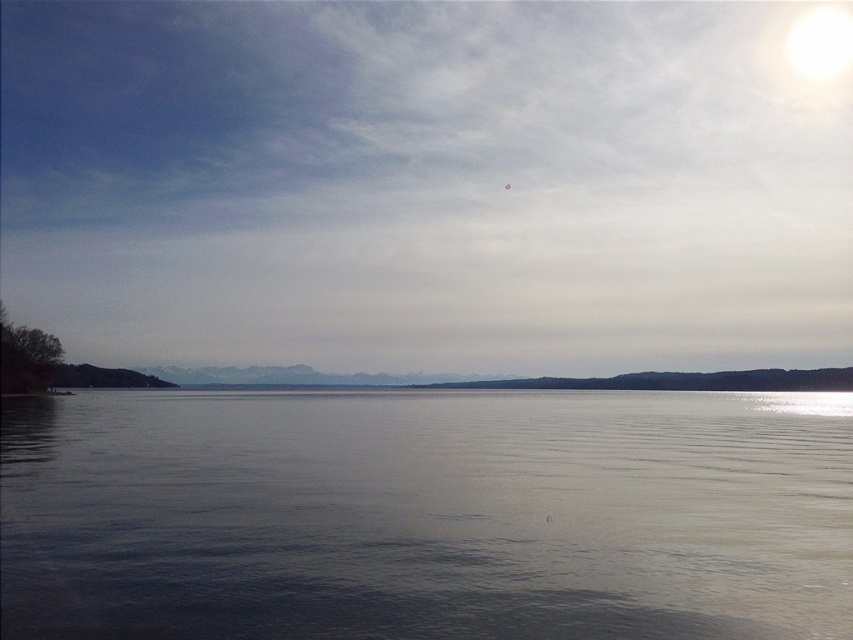
Question: Which point appears farthest from the camera in this image?

Choices:
 (A) (317, 326)
 (B) (749, 618)

Answer: (A)

Question: Is matte white sky at upper center thinner than smooth gray water at center?

Choices:
 (A) no
 (B) yes

Answer: (A)

Question: Can you confirm if matte white sky at upper center is thinner than smooth gray water at center?

Choices:
 (A) no
 (B) yes

Answer: (A)

Question: Which of the following is the closest to the observer?

Choices:
 (A) (334, 321)
 (B) (602, 548)

Answer: (B)

Question: Can you confirm if matte white sky at upper center is smaller than smooth gray water at center?

Choices:
 (A) no
 (B) yes

Answer: (A)